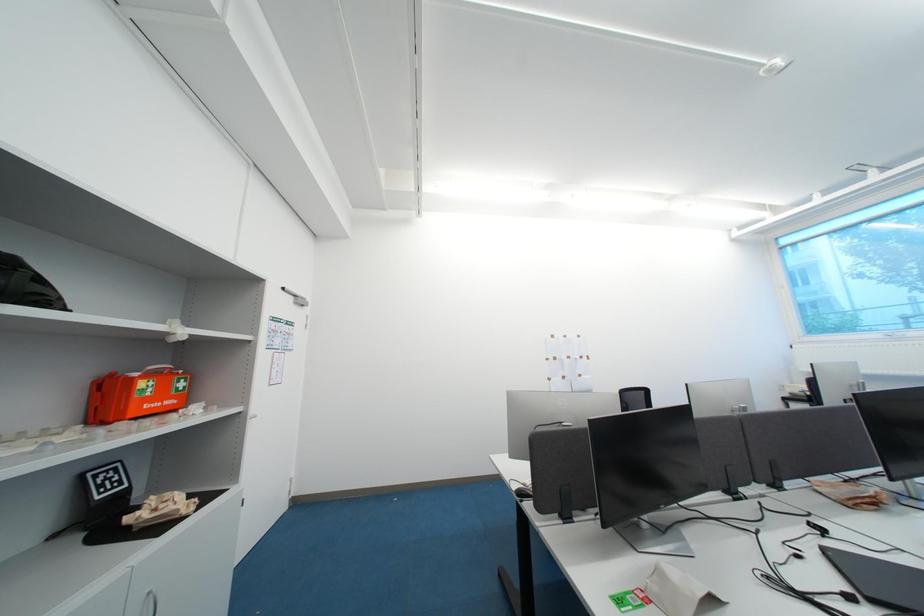
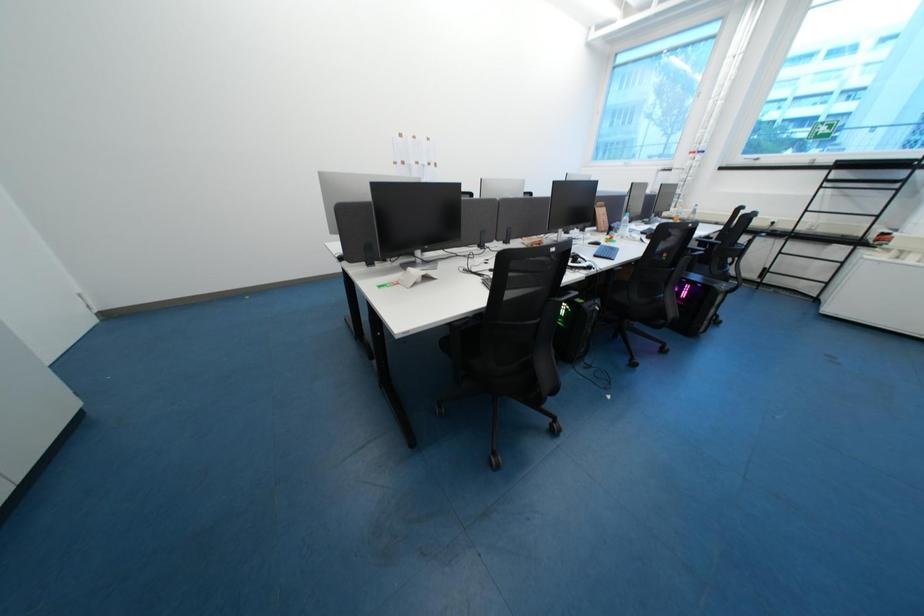
Based on the continuous images, in which direction is the camera rotating?

The camera rotated toward right-down.